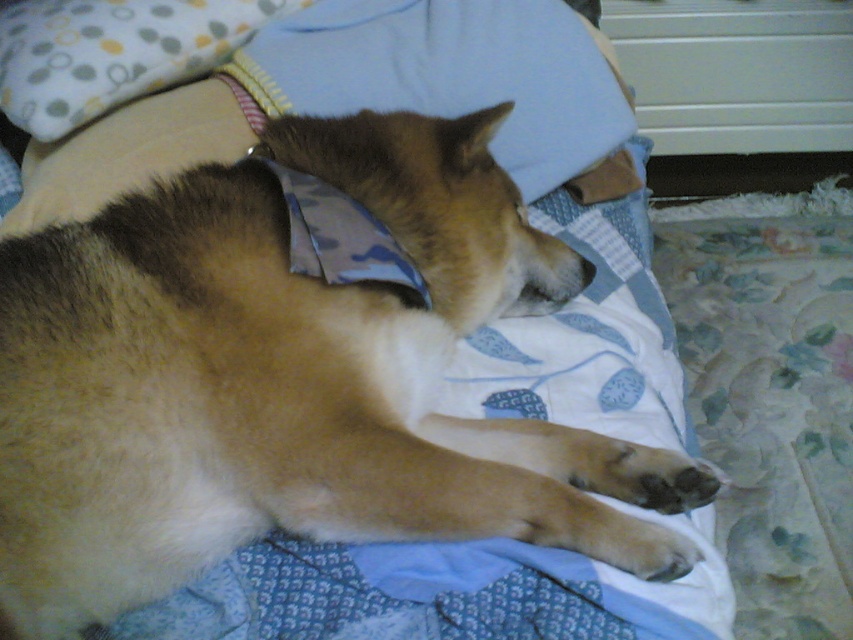
You are a robotic pet sitter who needs to place a water bowl between the brown fur dog at center and the soft cotton pillow at upper left. The bowl requires 12 inches of space. Is there enough space between them?

The distance between the brown fur dog at center and the soft cotton pillow at upper left is 18.62 inches, which is more than the required 12 inches. Therefore, there is sufficient space to place the water bowl between them.

You are a photographer trying to capture a closeup of the soft cotton pillow at upper left. However, the brown fur dog at center is blocking your view. Can you move the pillow to the side to get a clear shot?

The brown fur dog at center is in front of the soft cotton pillow at upper left, so you cannot move the pillow without moving the dog first.

You are trying to place a new toy for the brown fur dog at center. Where should you put it so that it is near the soft cotton pillow at upper left but not under the pillow?

The brown fur dog at center is located below the soft cotton pillow at upper left, so placing the toy near the pillow but above the dog would keep it close to the pillow without being under it.